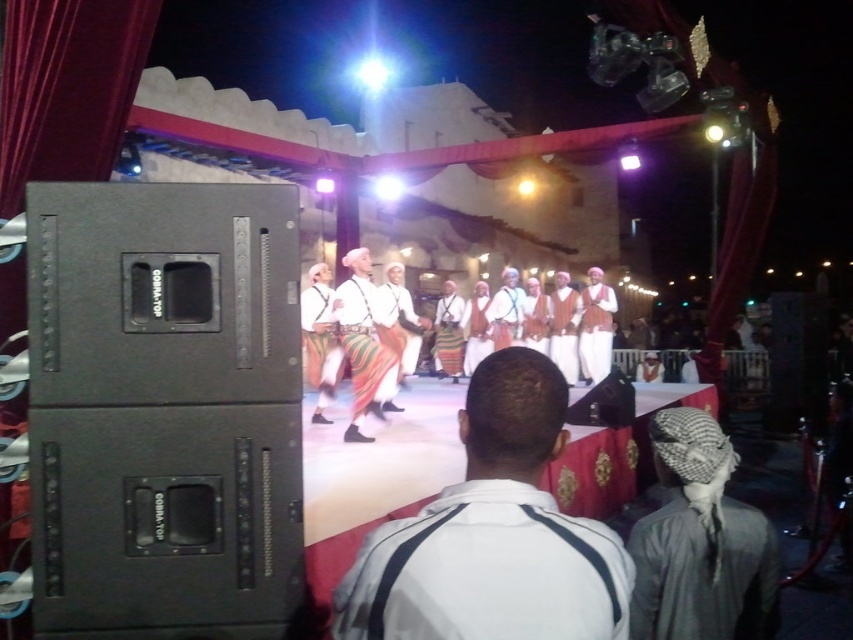
Question: Can you confirm if white fabric at center is wider than dark gray fabric headscarf at center?

Choices:
 (A) no
 (B) yes

Answer: (A)

Question: Which object is the closest to the dark gray fabric headscarf at center?

Choices:
 (A) multicolored fabric pants at center
 (B) white fabric at center

Answer: (B)

Question: Is dark gray fabric headscarf at center closer to the viewer compared to multicolored fabric pants at center?

Choices:
 (A) yes
 (B) no

Answer: (A)

Question: Considering the relative positions of white fabric at center and dark gray fabric headscarf at center in the image provided, where is white fabric at center located with respect to dark gray fabric headscarf at center?

Choices:
 (A) left
 (B) right

Answer: (A)

Question: Which of the following is the farthest from the observer?

Choices:
 (A) dark gray fabric headscarf at center
 (B) white fabric at center

Answer: (A)

Question: Which of the following is the closest to the observer?

Choices:
 (A) (345, 349)
 (B) (515, 577)

Answer: (B)